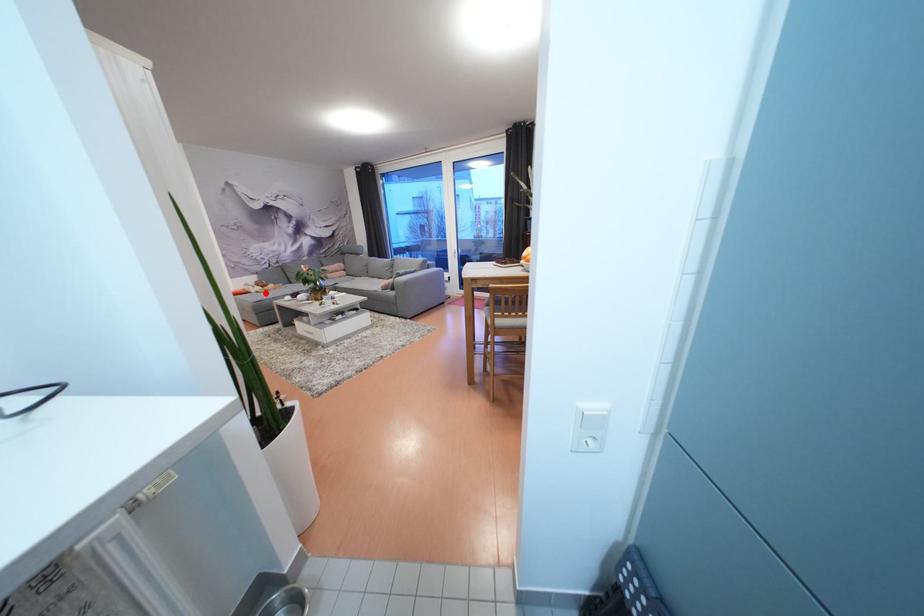
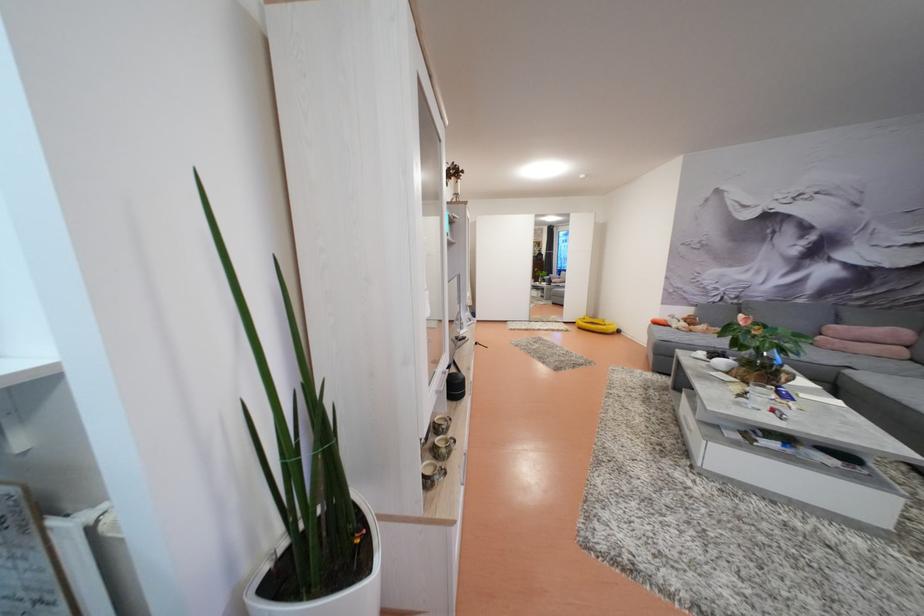
Question: A red point is marked in image1. In image2, is the corresponding 3D point closer to the camera or farther? Reply with the corresponding letter.

Choices:
 (A) The corresponding 3D point is closer.
 (B) The corresponding 3D point is farther.

Answer: (A)